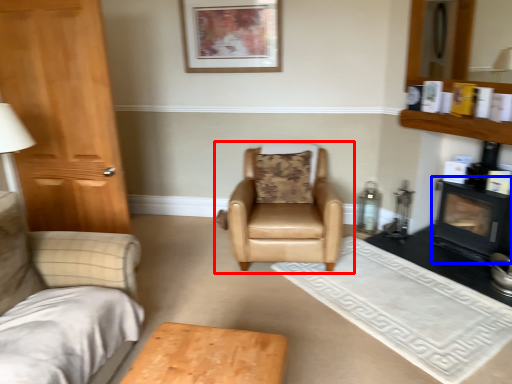
Question: Which of the following is the farthest to the observer, chair (highlighted by a red box) or fireplace (highlighted by a blue box)?

Choices:
 (A) chair
 (B) fireplace

Answer: (A)